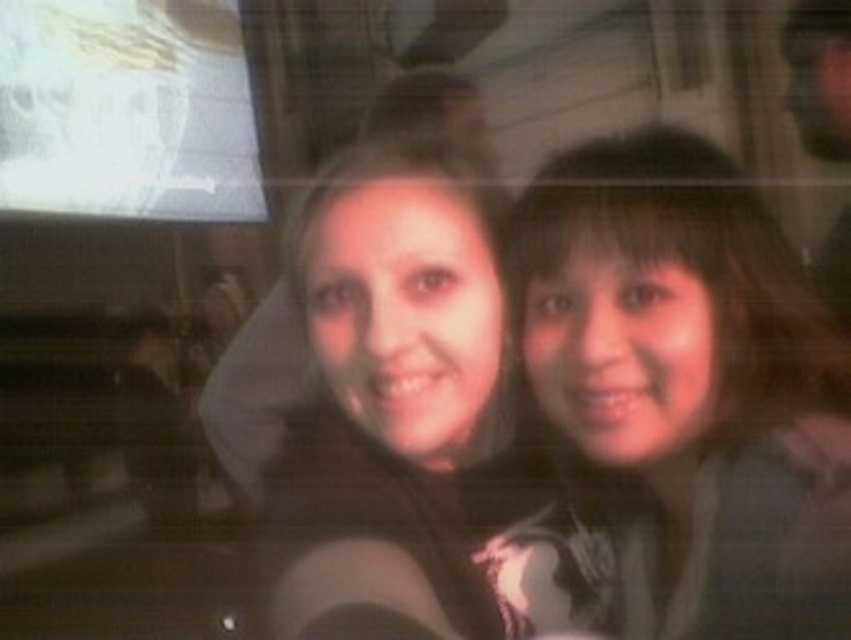
Question: Which point is closer to the camera?

Choices:
 (A) (523, 586)
 (B) (817, 134)

Answer: (A)

Question: Is smooth brown hair at right to the left of smooth brown hair at upper right from the viewer's perspective?

Choices:
 (A) yes
 (B) no

Answer: (A)

Question: Which of the following is the farthest from the observer?

Choices:
 (A) (794, 506)
 (B) (843, 161)

Answer: (B)

Question: Is smooth brown hair at right below smooth brown hair at upper right?

Choices:
 (A) yes
 (B) no

Answer: (A)

Question: Does smooth brown hair at right appear on the right side of smooth brown hair at upper right?

Choices:
 (A) no
 (B) yes

Answer: (A)